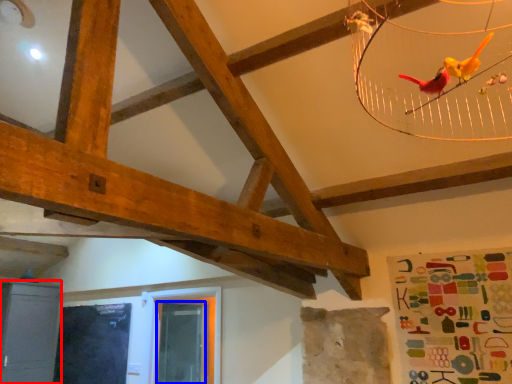
Question: Which object is closer to the camera taking this photo, furniture (highlighted by a red box) or window screen (highlighted by a blue box)?

Choices:
 (A) furniture
 (B) window screen

Answer: (A)